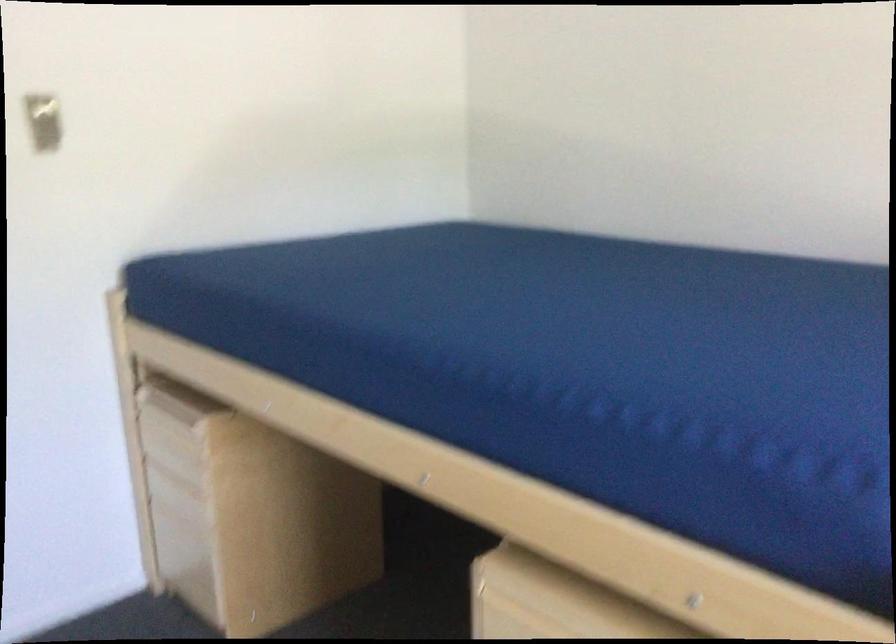
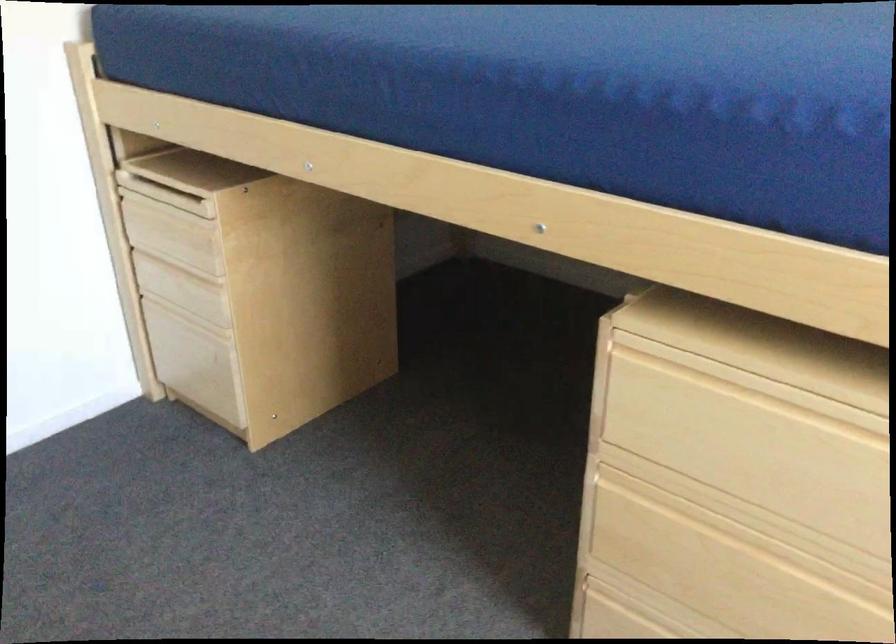
The point at (187, 562) is marked in the first image. Where is the corresponding point in the second image?

(195, 361)